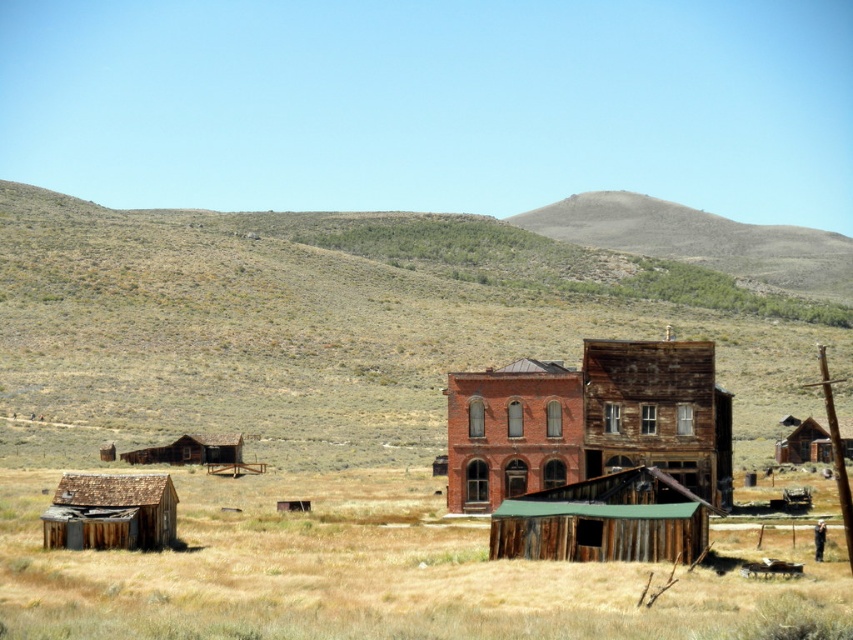
Is wooden shack at center further to camera compared to wooden shack at right?

No, it is in front of wooden shack at right.

Which is behind, point (709, 342) or point (811, 461)?

Positioned behind is point (811, 461).

At what (x,y) coordinates should I click in order to perform the action: click on wooden shack at center. Please return your answer as a coordinate pair (x, y). Looking at the image, I should click on (589, 420).

Find the location of a particular element. The height and width of the screenshot is (640, 853). wooden shack at center is located at coordinates (589, 420).

Does green grassy hillside at center appear on the left side of red brick building at center?

Incorrect, green grassy hillside at center is not on the left side of red brick building at center.

Between green grassy hillside at center and red brick building at center, which one has more height?

green grassy hillside at center

Which is behind, point (183, 385) or point (489, 493)?

Positioned behind is point (183, 385).

Find the location of a particular element. This screenshot has height=640, width=853. green grassy hillside at center is located at coordinates (335, 326).

Looking at this image, is the position of green grassy hillside at center less distant than that of rustic wooden hut at left?

Yes, it is in front of rustic wooden hut at left.

Between green grassy hillside at center and rustic wooden hut at left, which one has more height?

Standing taller between the two is green grassy hillside at center.

Who is more forward, (518, 314) or (177, 460)?

Point (177, 460) is more forward.

Where is `green grassy hillside at center`? green grassy hillside at center is located at coordinates (335, 326).